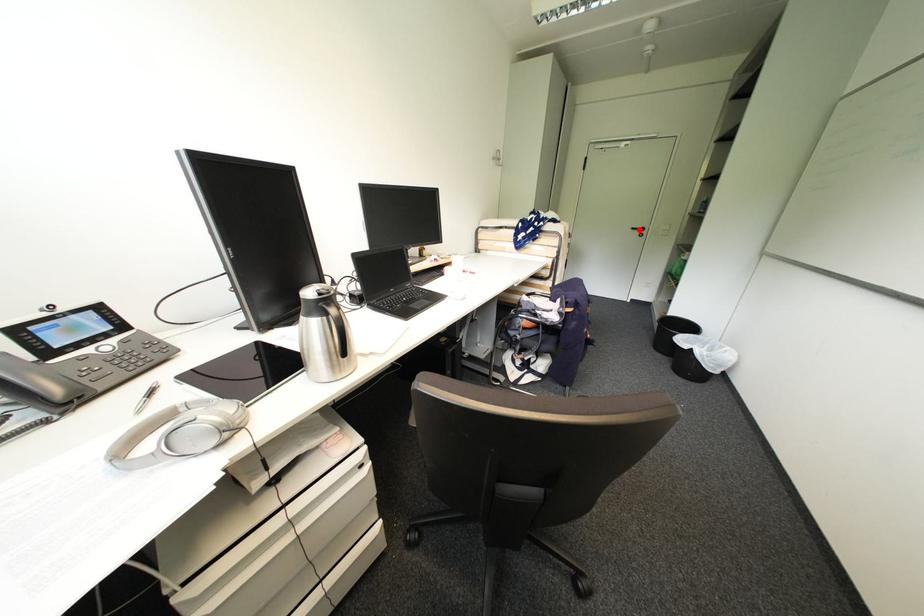
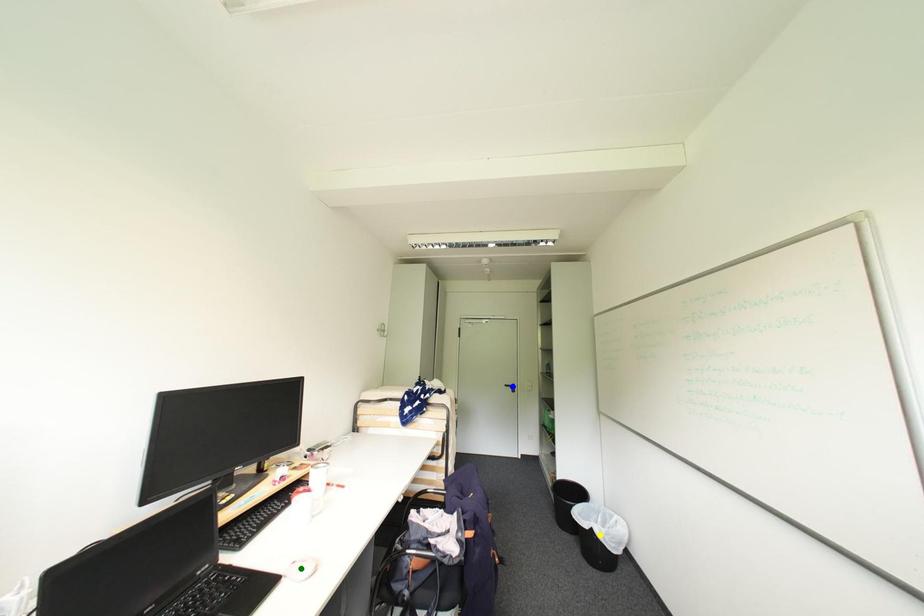
Question: I am providing you with two images of the same scene from different viewpoints. A red point is marked on the first image. You are given multiple points on the second image. Which point in image 2 is actually the same real-world point as the red point in image 1?

Choices:
 (A) yellow point
 (B) blue point
 (C) green point

Answer: (B)